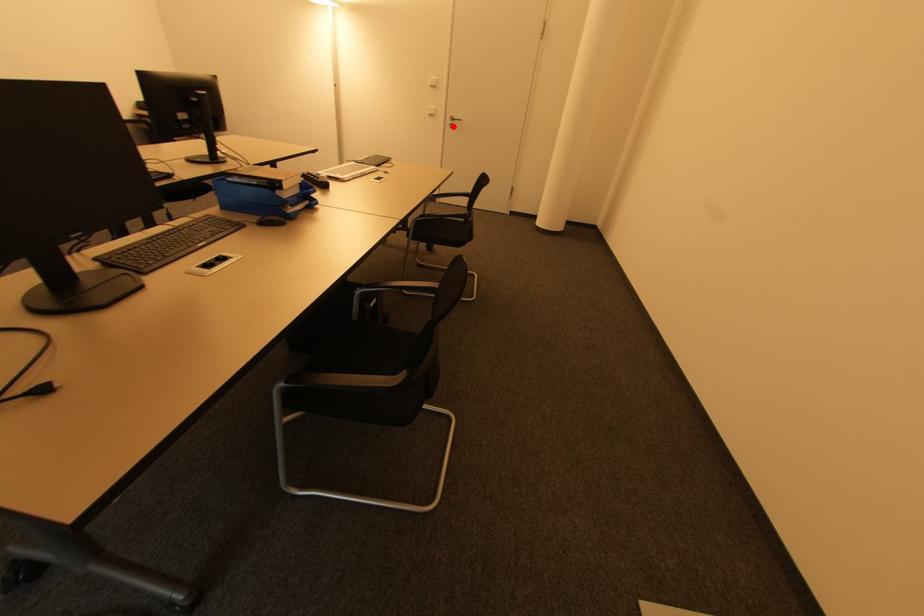
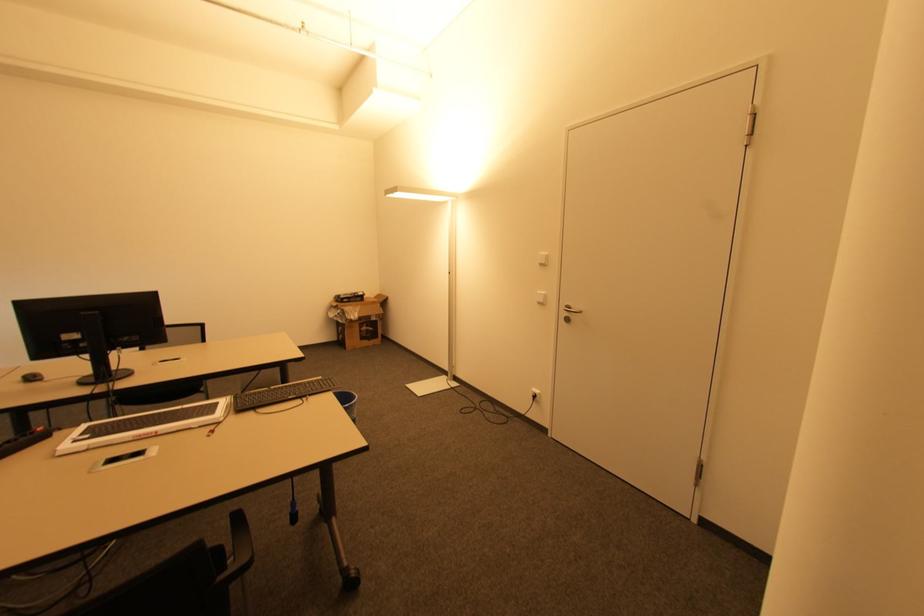
Question: I am providing you with two images of the same scene from different viewpoints. A red point is marked on the first image. Is the red point's position out of view in image 2?

Choices:
 (A) Yes
 (B) No

Answer: (B)